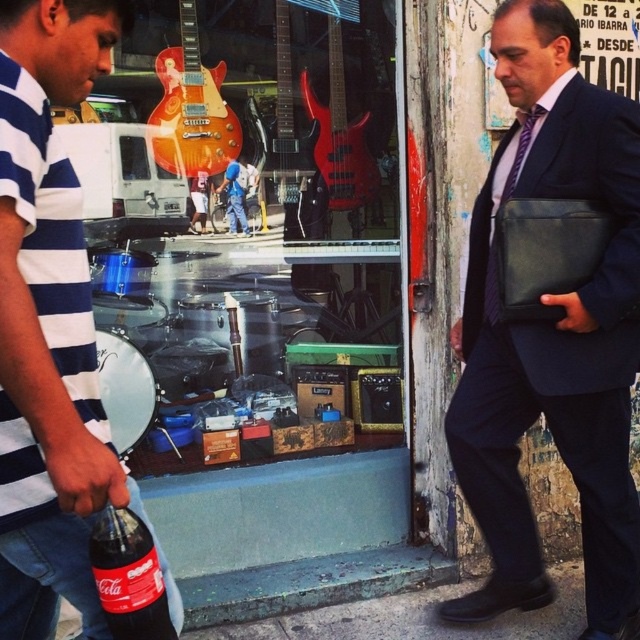
Question: Which is nearer to the green concrete pavement at lower center?

Choices:
 (A) translucent plastic bottle at lower left
 (B) purple striped tie at right

Answer: (B)

Question: Is matte black briefcase at center bigger than purple striped tie at right?

Choices:
 (A) no
 (B) yes

Answer: (B)

Question: Among these objects, which one is nearest to the camera?

Choices:
 (A) purple striped tie at right
 (B) striped cotton shirt at left
 (C) translucent plastic bottle at lower left
 (D) matte black briefcase at center

Answer: (B)

Question: Can you confirm if green concrete pavement at lower center is positioned above translucent plastic bottle at lower left?

Choices:
 (A) yes
 (B) no

Answer: (B)

Question: Which object appears farthest from the camera in this image?

Choices:
 (A) translucent plastic bottle at lower left
 (B) striped cotton shirt at left
 (C) green concrete pavement at lower center
 (D) purple striped tie at right

Answer: (C)

Question: Can you confirm if striped cotton shirt at left is smaller than green concrete pavement at lower center?

Choices:
 (A) yes
 (B) no

Answer: (B)